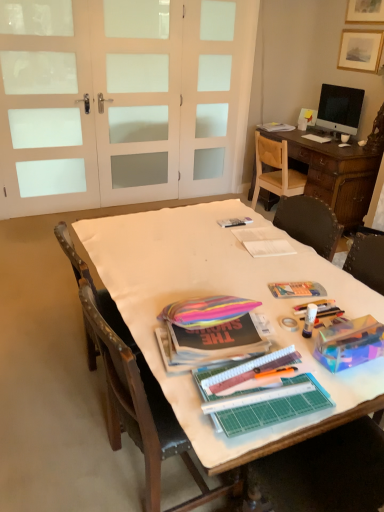
What is the approximate height of matte black magazine at upper center, positioned as the 1th magazine in right-to-left order?

matte black magazine at upper center, positioned as the 1th magazine in right-to-left order, is 1.78 inches in height.

The width and height of the screenshot is (384, 512). What do you see at coordinates (275, 170) in the screenshot?
I see `wooden chair at right, which is counted as the 1th chair, starting from the top` at bounding box center [275, 170].

Where is `wooden picture frame at upper right`? The width and height of the screenshot is (384, 512). wooden picture frame at upper right is located at coordinates (360, 50).

The width and height of the screenshot is (384, 512). I want to click on matte paper magazine at center, placed as the 2th magazine when sorted from right to left, so click(264, 241).

Is white fabric-covered table at center located within matte paper magazine at center, the 2th magazine from the back?

Definitely not — white fabric-covered table at center is not inside matte paper magazine at center, the 2th magazine from the back.

Is point (283, 248) less distant than point (363, 311)?

No, (283, 248) is behind (363, 311).

From the image's perspective, which is above, matte paper magazine at center, which appears as the second magazine when viewed from the left, or white fabric-covered table at center?

matte paper magazine at center, which appears as the second magazine when viewed from the left.

Who is smaller, matte paper magazine at center, the second magazine positioned from the bottom, or white fabric-covered table at center?

matte paper magazine at center, the second magazine positioned from the bottom, is smaller.

Could you tell me if white fabric-covered table at center is facing white frosted glass doors at upper left, placed as the second screen door when sorted from left to right?

Yes, white fabric-covered table at center is aimed at white frosted glass doors at upper left, placed as the second screen door when sorted from left to right.

From a real-world perspective, which is physically above, white fabric-covered table at center or white frosted glass doors at upper left, which appears as the 2th screen door when viewed from the right?

In real-world perspective, white frosted glass doors at upper left, which appears as the 2th screen door when viewed from the right, is above.

In terms of size, does white fabric-covered table at center appear bigger or smaller than white frosted glass doors at upper left, which appears as the 2th screen door when viewed from the right?

white fabric-covered table at center is bigger than white frosted glass doors at upper left, which appears as the 2th screen door when viewed from the right.

Would you consider rainbow fabric bag at center, arranged as the 1th magazine when viewed from the left, to be distant from matte black magazine at upper center, the 1th magazine from the back?

Yes, rainbow fabric bag at center, arranged as the 1th magazine when viewed from the left, and matte black magazine at upper center, the 1th magazine from the back, are located far from each other.

From a real-world perspective, which object stands above the other?

From a 3D spatial view, rainbow fabric bag at center, arranged as the 1th magazine when viewed from the left, is above.

This screenshot has height=512, width=384. I want to click on the 2nd magazine to the left of the matte black magazine at upper center, the 1th magazine from the back, counting from the anchor's position, so click(210, 331).

Would you say matte black magazine at upper center, the 1th magazine from the back, is part of rainbow fabric bag at center, placed as the 1th magazine when sorted from front to back,'s contents?

No, matte black magazine at upper center, the 1th magazine from the back, is not a part of rainbow fabric bag at center, placed as the 1th magazine when sorted from front to back.

Can you confirm if matte black magazine at upper center, positioned as the 1th magazine in right-to-left order, is shorter than white fabric-covered table at center?

Yes, matte black magazine at upper center, positioned as the 1th magazine in right-to-left order, is shorter than white fabric-covered table at center.

Is matte black magazine at upper center, positioned as the 1th magazine in right-to-left order, directly adjacent to white fabric-covered table at center?

No, matte black magazine at upper center, positioned as the 1th magazine in right-to-left order, is not in contact with white fabric-covered table at center.

Between point (290, 126) and point (205, 417), which one is positioned in front?

Point (205, 417)

Is white frosted glass doors at upper left, which appears as the 2th screen door when viewed from the right, wider or thinner than white paper at center?

Considering their sizes, white frosted glass doors at upper left, which appears as the 2th screen door when viewed from the right, looks slimmer than white paper at center.

Who is smaller, white frosted glass doors at upper left, placed as the second screen door when sorted from left to right, or white paper at center?

white paper at center is smaller.

Would you consider white frosted glass doors at upper left, which appears as the 2th screen door when viewed from the right, to be distant from white paper at center?

white frosted glass doors at upper left, which appears as the 2th screen door when viewed from the right, is positioned a significant distance from white paper at center.

Locate an element on the screen. notebook on the right of white frosted glass doors at upper left, which appears as the 2th screen door when viewed from the right is located at coordinates (317, 138).

Is the position of rainbow fabric bag at center, which is counted as the third magazine, starting from the back, less distant than that of white frosted glass doors at upper left, placed as the second screen door when sorted from left to right?

Yes, rainbow fabric bag at center, which is counted as the third magazine, starting from the back, is closer to the camera.

Consider the image. How many degrees apart are the facing directions of rainbow fabric bag at center, placed as the 1th magazine when sorted from front to back, and white frosted glass doors at upper left, which appears as the 2th screen door when viewed from the right?

rainbow fabric bag at center, placed as the 1th magazine when sorted from front to back, and white frosted glass doors at upper left, which appears as the 2th screen door when viewed from the right, are facing 179 degrees away from each other.

Is rainbow fabric bag at center, which appears as the 1th magazine when ordered from the bottom, smaller than white frosted glass doors at upper left, placed as the second screen door when sorted from left to right?

Yes, rainbow fabric bag at center, which appears as the 1th magazine when ordered from the bottom, is smaller than white frosted glass doors at upper left, placed as the second screen door when sorted from left to right.

This screenshot has width=384, height=512. What are the coordinates of `the 2nd screen door behind the rainbow fabric bag at center, which ranks as the 3th magazine in right-to-left order, starting your count from the anchor` in the screenshot? It's located at (137, 98).

Locate an element on the screen. The width and height of the screenshot is (384, 512). chair that is the 2nd object located below the white frosted glass doors at upper left, which appears as the third screen door when viewed from the right (from the image's perspective) is located at coordinates (139, 399).

Which is closer to the camera, [72,127] or [127,387]?

Clearly, point [72,127] is more distant from the camera than point [127,387].

From the image's perspective, which object appears higher, white frosted glass doors at upper left, acting as the first screen door starting from the left, or wooden chair at center, positioned as the 2th chair in back-to-front order?

From the image's view, white frosted glass doors at upper left, acting as the first screen door starting from the left, is above.

Does white frosted glass doors at upper left, which appears as the third screen door when viewed from the right, have a smaller size compared to wooden chair at center, the 1th chair from the front?

Correct, white frosted glass doors at upper left, which appears as the third screen door when viewed from the right, occupies less space than wooden chair at center, the 1th chair from the front.

You are a GUI agent. You are given a task and a screenshot of the screen. Output one action in this format:
    pyautogui.click(x=<x>, y=<y>)
    Task: Click on the 1st magazine above the white fabric-covered table at center (from a real-world perspective)
    The image size is (384, 512).
    Given the screenshot: What is the action you would take?
    pyautogui.click(x=264, y=241)

You are a GUI agent. You are given a task and a screenshot of the screen. Output one action in this format:
    pyautogui.click(x=<x>, y=<y>)
    Task: Click on the 1st screen door to the left of the white fabric-covered table at center, starting your count from the anchor
    The height and width of the screenshot is (512, 384).
    Given the screenshot: What is the action you would take?
    pyautogui.click(x=137, y=98)

Estimate the real-world distances between objects in this image. Which object is further from matte black magazine at upper center, positioned as the 1th magazine in right-to-left order, white frosted glass doors at upper left, placed as the second screen door when sorted from left to right, or white paper at center?

white frosted glass doors at upper left, placed as the second screen door when sorted from left to right, lies further to matte black magazine at upper center, positioned as the 1th magazine in right-to-left order, than the other object.

From the image, which object appears to be farther from white frosted glass doors at upper left, acting as the first screen door starting from the left, wooden chair at center, the 1th chair from the front, or white frosted glass screen door at upper center, placed as the 1th screen door when sorted from right to left?

The object further to white frosted glass doors at upper left, acting as the first screen door starting from the left, is wooden chair at center, the 1th chair from the front.

Based on their spatial positions, is rainbow fabric bag at center, which is counted as the third magazine, starting from the back, or wooden chair at center, the 1th chair from the front, further from matte black magazine at upper center, positioned as the third magazine in left-to-right order?

wooden chair at center, the 1th chair from the front, lies further to matte black magazine at upper center, positioned as the third magazine in left-to-right order, than the other object.

Considering their positions, is white frosted glass doors at upper left, which appears as the 2th screen door when viewed from the right, positioned closer to matte black magazine at upper center, positioned as the 1th magazine in right-to-left order, than white fabric-covered table at center?

The object closer to matte black magazine at upper center, positioned as the 1th magazine in right-to-left order, is white frosted glass doors at upper left, which appears as the 2th screen door when viewed from the right.

From the image, which object appears to be farther from matte black magazine at upper center, positioned as the first magazine in top-to-bottom order, white frosted glass doors at upper left, which appears as the third screen door when viewed from the right, or wooden chair at center, the 1th chair in the bottom-to-top sequence?

wooden chair at center, the 1th chair in the bottom-to-top sequence.

From the image, which object appears to be nearer to white paper at center, rainbow fabric bag at center, arranged as the 1th magazine when viewed from the left, or white fabric-covered table at center?

white fabric-covered table at center.

Estimate the real-world distances between objects in this image. Which object is further from wooden picture frame at upper right, rainbow fabric bag at center, which is the 3th magazine from top to bottom, or white frosted glass doors at upper left, which appears as the third screen door when viewed from the right?

rainbow fabric bag at center, which is the 3th magazine from top to bottom.

When comparing their distances from white frosted glass screen door at upper center, which is the third screen door from left to right, does white frosted glass doors at upper left, acting as the first screen door starting from the left, or white paper at center seem closer?

white paper at center.

You are a GUI agent. You are given a task and a screenshot of the screen. Output one action in this format:
    pyautogui.click(x=<x>, y=<y>)
    Task: Click on the notebook between rainbow fabric bag at center, which ranks as the 3th magazine in right-to-left order, and matte black magazine at upper center, positioned as the third magazine in left-to-right order, in the front-back direction
    The height and width of the screenshot is (512, 384).
    Given the screenshot: What is the action you would take?
    pyautogui.click(x=317, y=138)

Identify the location of picture frame between white fabric-covered table at center and matte black magazine at upper center, positioned as the 1th magazine in right-to-left order, from front to back. (360, 50).

Find the location of a particular element. chair positioned between matte paper magazine at center, positioned as the second magazine in top-to-bottom order, and white paper at center from near to far is located at coordinates (275, 170).

Locate an element on the screen. The height and width of the screenshot is (512, 384). picture frame between matte paper magazine at center, which appears as the second magazine when viewed from the left, and matte black magazine at upper center, positioned as the third magazine in bottom-to-top order, from front to back is located at coordinates (360, 50).